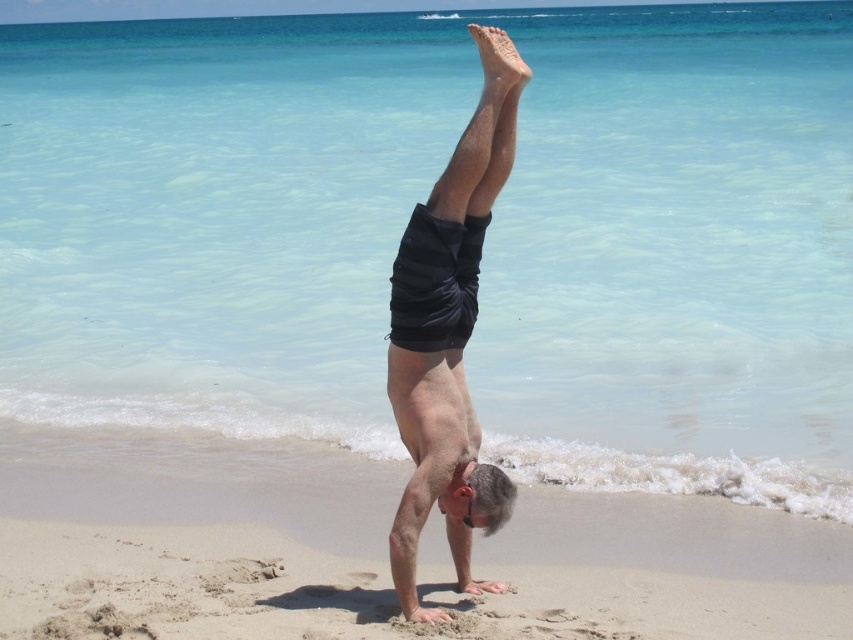
You are a photographer trying to capture the perfect shot of the person doing a handstand on the beige sandy beach at center. You want to ensure that your camera is focused precisely on the point labeled as point [186,513]. Where exactly should you aim your camera to capture this point?

The point [186,513] corresponds to the beige sandy beach at center, so you should aim your camera at the beige sandy beach at center to capture this point.

You are a photographer trying to capture the entire scene of the beige sandy beach at center and the black striped shorts at center in one shot. Based on their widths, which object should you focus on to ensure both are fully visible in the frame?

The beige sandy beach at center is wider than the black striped shorts at center. To ensure both are fully visible in the frame, focus on the wider beige sandy beach at center as it occupies more space, allowing the narrower black striped shorts at center to fit within the same shot.

You are a photographer trying to capture the entire scene of the beige sandy beach at center and the black striped shorts at center in one shot. Considering their sizes, which object should you focus on to ensure both are visible without cropping?

The beige sandy beach at center is bigger than the black striped shorts at center, so focusing on the larger beige sandy beach at center will ensure both objects are visible in the frame without cropping.